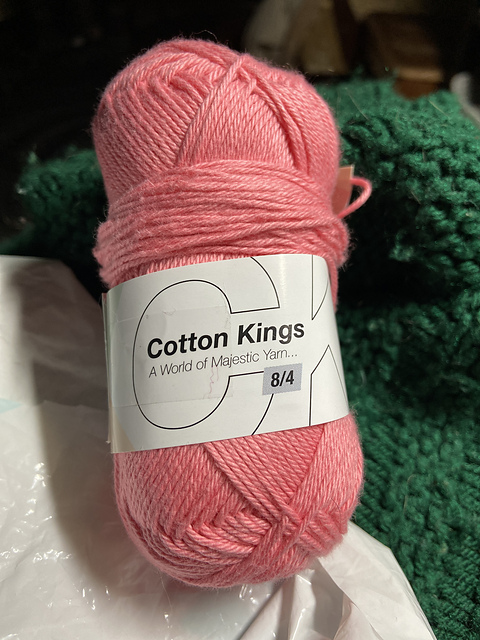
At what (x,y) coordinates should I click in order to perform the action: click on light brown and beige wooden piece. Please return your answer as a coordinate pair (x, y). Looking at the image, I should click on (409, 45).